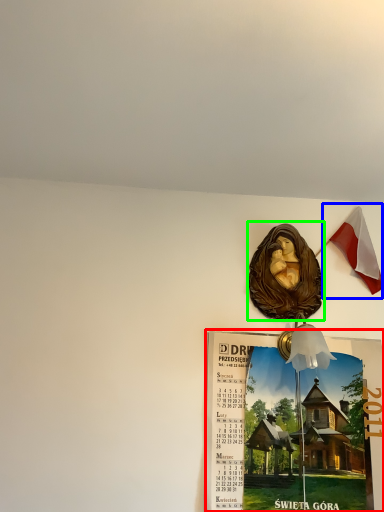
Question: Considering the real-world distances, which object is closest to poster page (highlighted by a red box)? national flag (highlighted by a blue box) or art (highlighted by a green box).

Choices:
 (A) national flag
 (B) art

Answer: (B)